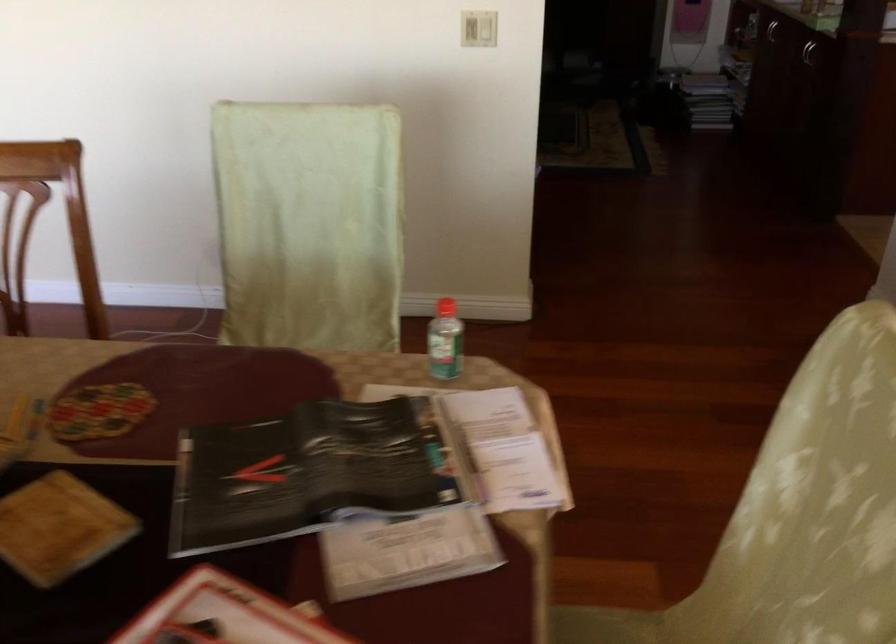
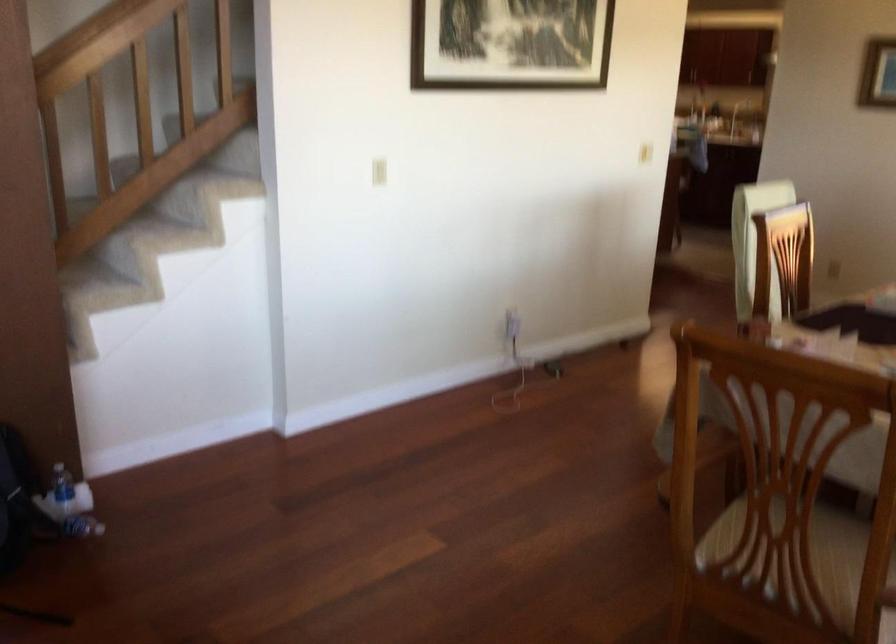
Question: I am providing you with two images of the same scene from different viewpoints. Which of the following objects are not visible in image2?

Choices:
 (A) wooden handrail
 (B) curved cabinet handle
 (C) light switch
 (D) crumpled paper

Answer: (B)